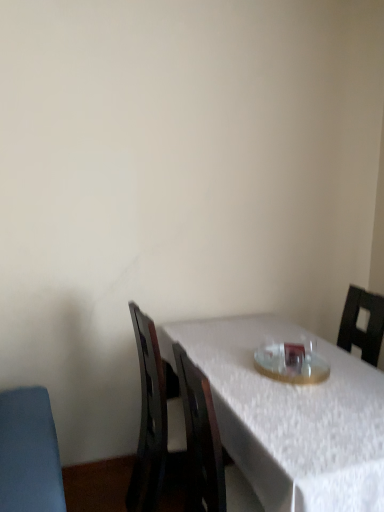
Image resolution: width=384 pixels, height=512 pixels. Identify the location of blank space situated above clear glass plate at center (from a real-world perspective). (287, 360).